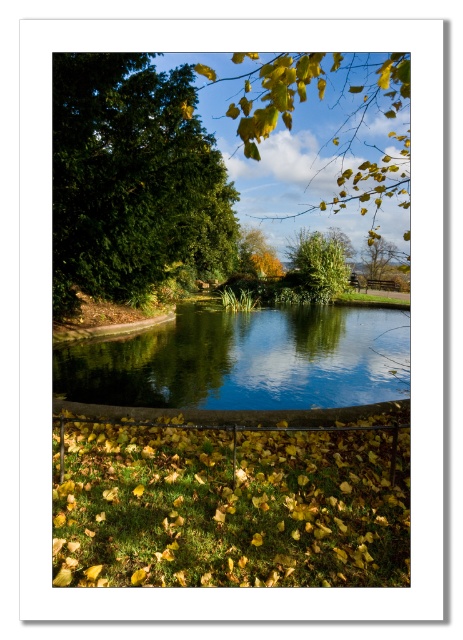
Between yellow leaf litter at lower center and green leafy tree at upper left, which one appears on the right side from the viewer's perspective?

From the viewer's perspective, yellow leaf litter at lower center appears more on the right side.

Between yellow leaf litter at lower center and green leafy tree at upper left, which one appears on the left side from the viewer's perspective?

green leafy tree at upper left is more to the left.

The width and height of the screenshot is (463, 640). Find the location of `yellow leaf litter at lower center`. yellow leaf litter at lower center is located at coordinates (229, 504).

Can you confirm if yellow leaf litter at lower center is positioned to the right of green leafy tree at upper center?

No, yellow leaf litter at lower center is not to the right of green leafy tree at upper center.

The image size is (463, 640). In order to click on yellow leaf litter at lower center in this screenshot , I will do pyautogui.click(x=229, y=504).

Which is in front, point (125, 221) or point (374, 252)?

Point (125, 221) is more forward.

Is green leafy tree at upper left shorter than green leafy tree at upper center?

Incorrect, green leafy tree at upper left's height does not fall short of green leafy tree at upper center's.

Describe the element at coordinates (132, 180) in the screenshot. This screenshot has width=463, height=640. I see `green leafy tree at upper left` at that location.

Find the location of a particular element. This screenshot has width=463, height=640. green leafy tree at upper left is located at coordinates click(x=132, y=180).